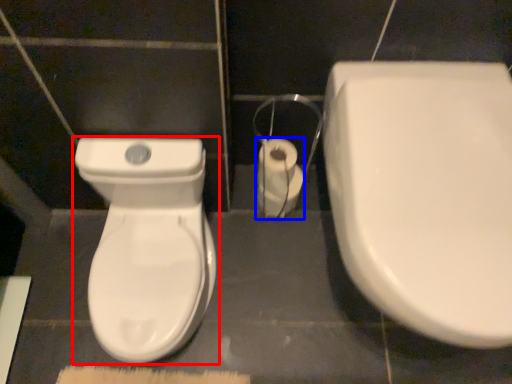
Question: Which point is further to the camera, toilet (highlighted by a red box) or toilet paper (highlighted by a blue box)?

Choices:
 (A) toilet
 (B) toilet paper

Answer: (B)